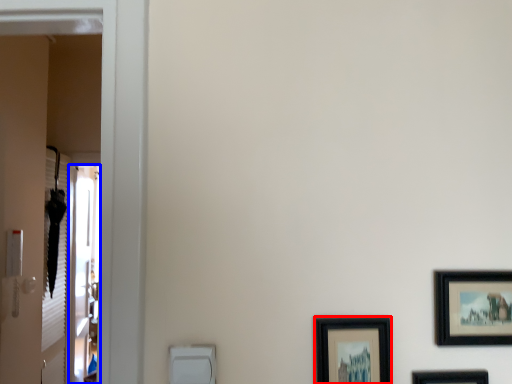
Question: Which of the following is the farthest to the observer, picture frame (highlighted by a red box) or screen door (highlighted by a blue box)?

Choices:
 (A) picture frame
 (B) screen door

Answer: (B)